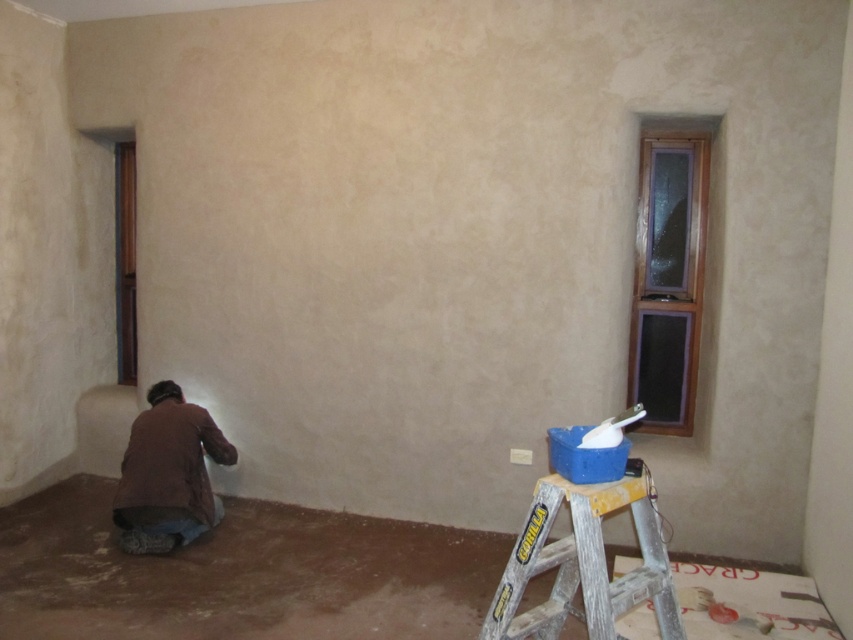
Question: Which of the following is the farthest from the observer?

Choices:
 (A) brown fabric at lower left
 (B) silver aluminum ladder at lower right

Answer: (A)

Question: Can you confirm if silver aluminum ladder at lower right is smaller than brown fabric at lower left?

Choices:
 (A) no
 (B) yes

Answer: (B)

Question: Which object appears closest to the camera in this image?

Choices:
 (A) brown fabric at lower left
 (B) silver aluminum ladder at lower right

Answer: (B)

Question: Where is silver aluminum ladder at lower right located in relation to brown fabric at lower left in the image?

Choices:
 (A) right
 (B) left

Answer: (A)

Question: Can you confirm if silver aluminum ladder at lower right is wider than brown fabric at lower left?

Choices:
 (A) no
 (B) yes

Answer: (B)